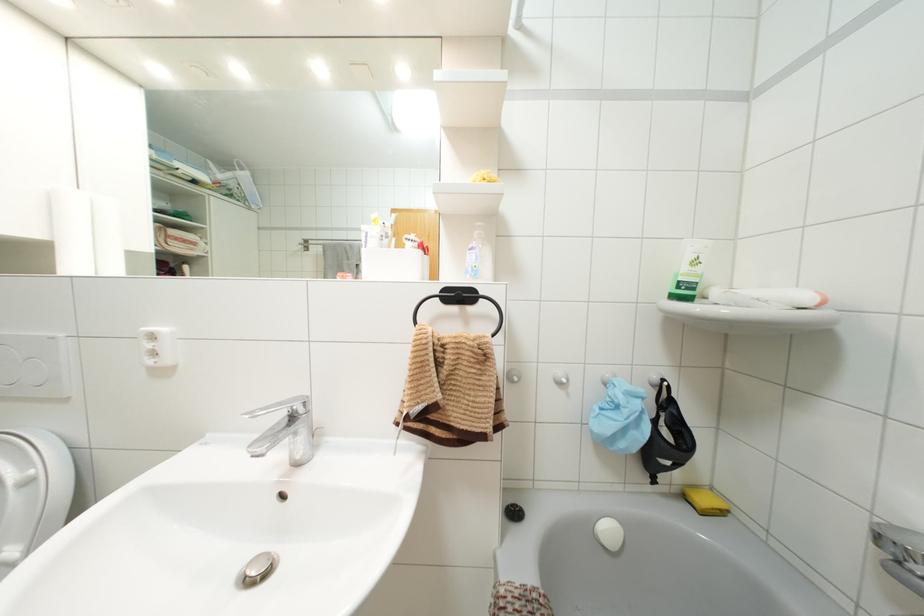
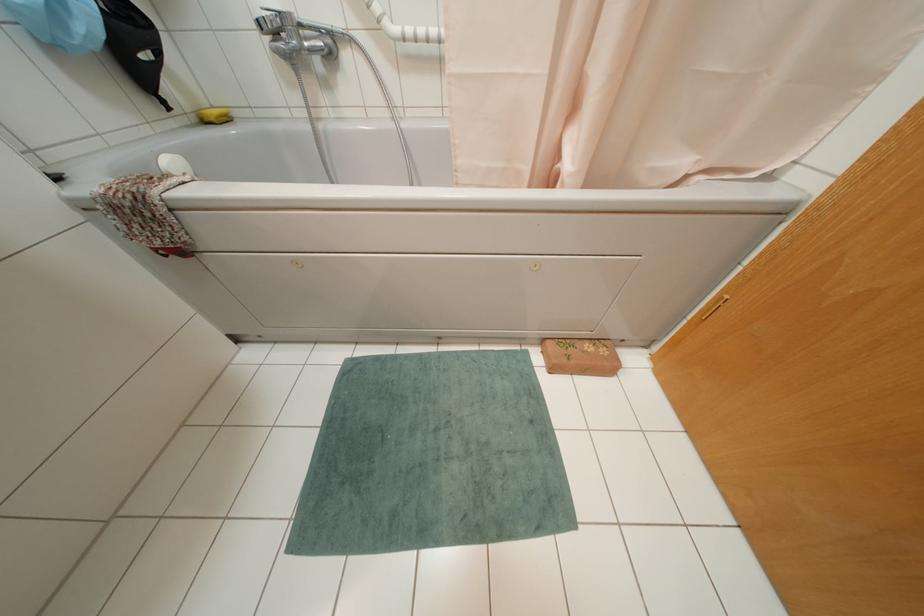
The point at (x=685, y=496) is marked in the first image. Where is the corresponding point in the second image?

(202, 121)